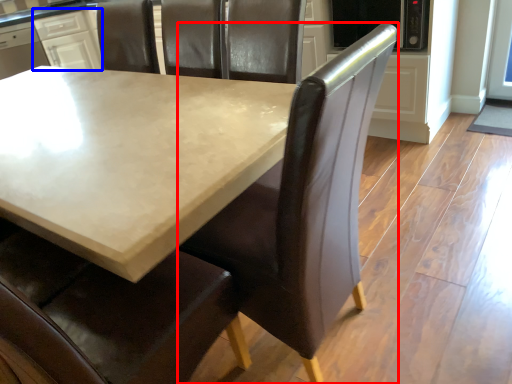
Question: Which of the following is the closest to the observer, chair (highlighted by a red box) or cabinetry (highlighted by a blue box)?

Choices:
 (A) chair
 (B) cabinetry

Answer: (A)